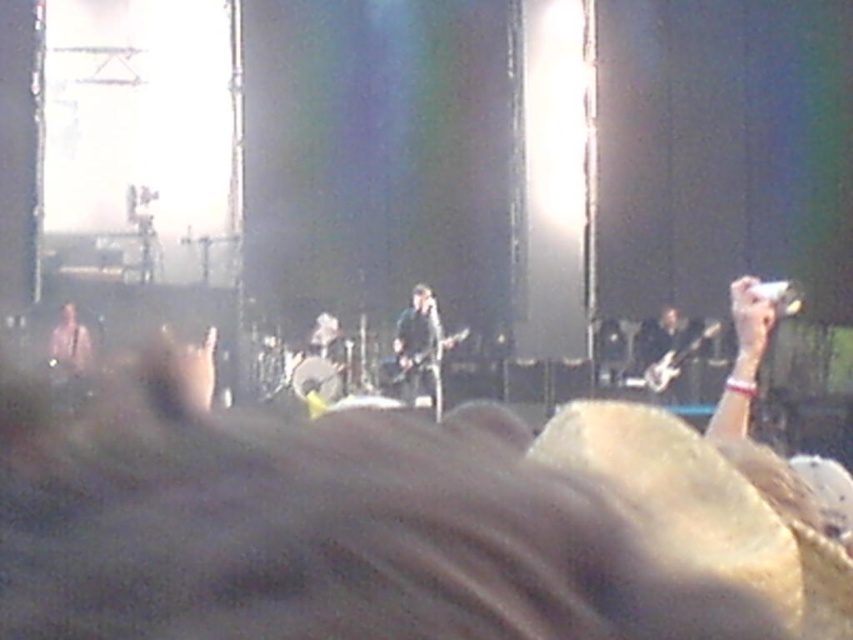
Question: Which point is closer to the camera taking this photo?

Choices:
 (A) (433, 342)
 (B) (59, 349)

Answer: (A)

Question: Can you confirm if shiny black guitar at center is positioned above matte black guitar at left?

Choices:
 (A) no
 (B) yes

Answer: (A)

Question: Which point is farther to the camera?

Choices:
 (A) shiny black guitar at center
 (B) matte black guitar at left

Answer: (B)

Question: Does shiny black guitar at center come in front of matte black guitar at left?

Choices:
 (A) yes
 (B) no

Answer: (A)

Question: Can you confirm if shiny black guitar at center is positioned above matte black guitar at left?

Choices:
 (A) no
 (B) yes

Answer: (A)

Question: Which of the following is the closest to the observer?

Choices:
 (A) (422, 332)
 (B) (78, 323)

Answer: (A)